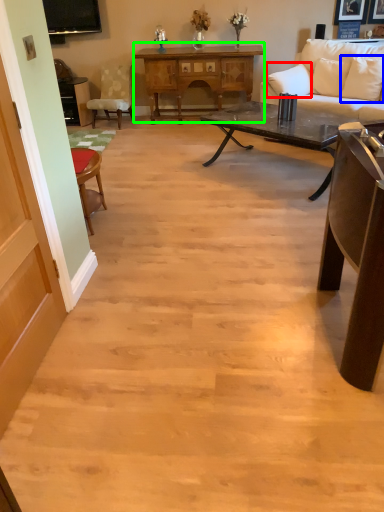
Question: Which object is positioned farthest from pillow (highlighted by a red box)? Select from pillow (highlighted by a blue box) and table (highlighted by a green box).

Choices:
 (A) pillow
 (B) table

Answer: (B)